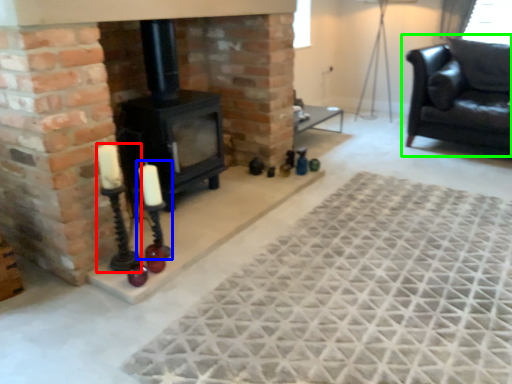
Question: Which is farther away from candle holder (highlighted by a red box)? candle holder (highlighted by a blue box) or studio couch (highlighted by a green box)?

Choices:
 (A) candle holder
 (B) studio couch

Answer: (B)